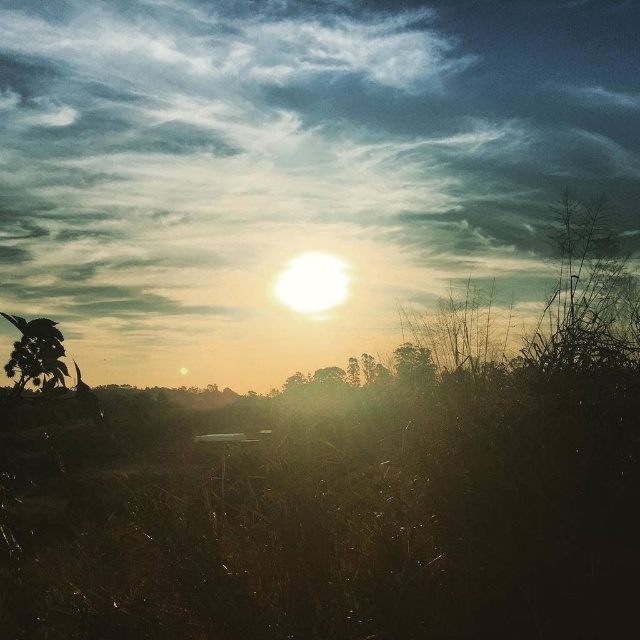
Question: Which of the following is the closest to the observer?

Choices:
 (A) (412, 365)
 (B) (17, 362)

Answer: (B)

Question: Does green leafy tree at lower left have a larger size compared to green matte tree at right?

Choices:
 (A) yes
 (B) no

Answer: (B)

Question: Can you confirm if green leafy tree at lower left is thinner than green matte tree at right?

Choices:
 (A) yes
 (B) no

Answer: (B)

Question: Where is green leafy tree at lower left located in relation to green matte tree at right in the image?

Choices:
 (A) below
 (B) above

Answer: (B)

Question: Among these objects, which one is farthest from the camera?

Choices:
 (A) green leafy tree at lower left
 (B) green matte tree at right

Answer: (B)